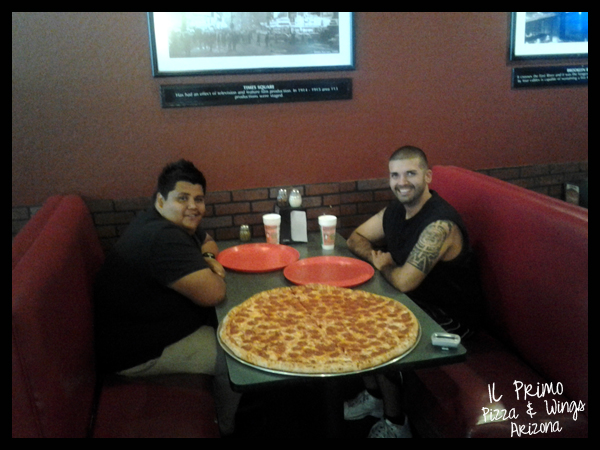
The height and width of the screenshot is (450, 600). I want to click on red backing of seat, so click(x=547, y=233), click(x=74, y=297).